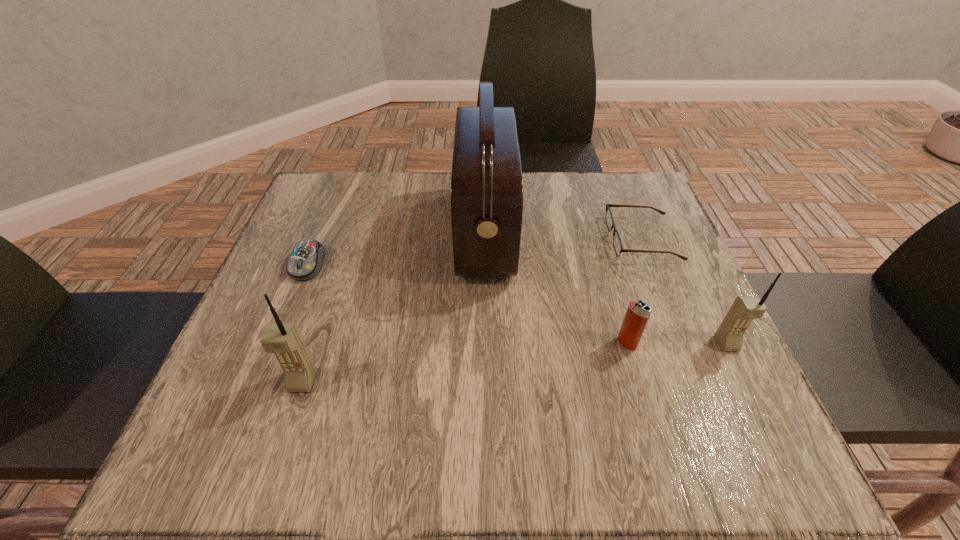
This screenshot has height=540, width=960. Identify the location of free space in the image that satisfies the following two spatial constraints: 1. on the front panel of the radio receiver; 2. on the right side of the igniter. (486, 343).